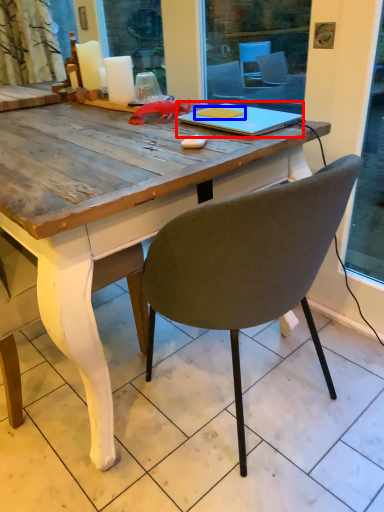
Question: Which object appears farthest to the camera in this image, notebook (highlighted by a red box) or notebook (highlighted by a blue box)?

Choices:
 (A) notebook
 (B) notebook

Answer: (B)